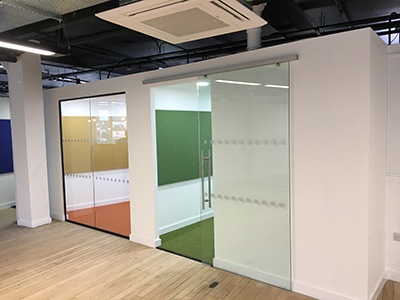
This screenshot has height=300, width=400. In order to click on outlet in this screenshot , I will do `click(396, 234)`.